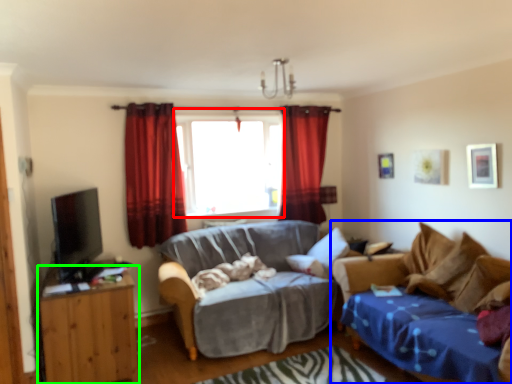
Question: Which is farther away from window (highlighted by a red box)? studio couch (highlighted by a blue box) or cabinetry (highlighted by a green box)?

Choices:
 (A) studio couch
 (B) cabinetry

Answer: (A)